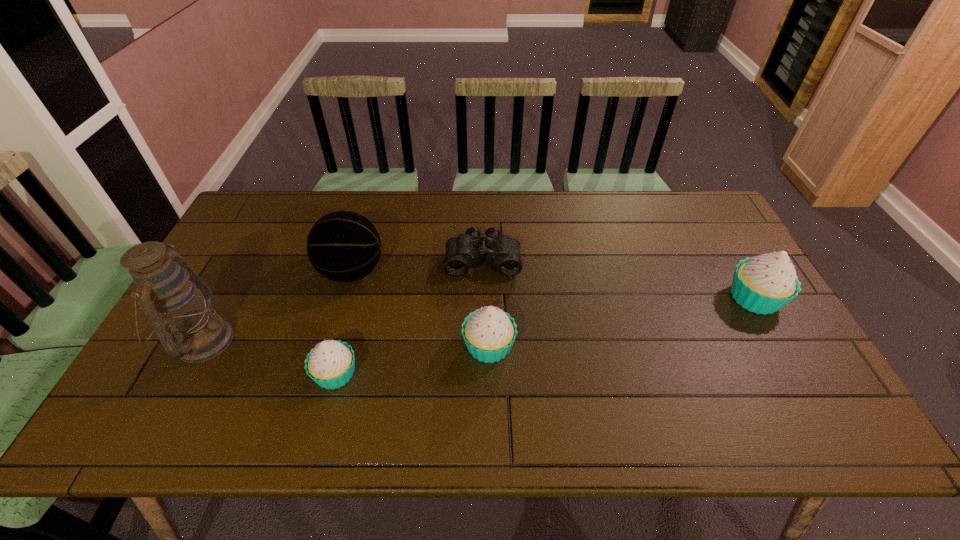
Where is `the shortest cupcake`? The width and height of the screenshot is (960, 540). the shortest cupcake is located at coordinates (330, 364).

What are the coordinates of `the second shortest object` in the screenshot? It's located at (330, 364).

Find the location of a particular element. This screenshot has width=960, height=540. the second shortest cupcake is located at coordinates (489, 333).

Image resolution: width=960 pixels, height=540 pixels. I want to click on the second cupcake from left to right, so click(x=489, y=333).

This screenshot has width=960, height=540. Identify the location of the rightmost object. (764, 284).

Locate an element on the screen. The height and width of the screenshot is (540, 960). the farthest cupcake is located at coordinates (764, 284).

Where is `the leftmost object`? The width and height of the screenshot is (960, 540). the leftmost object is located at coordinates (169, 292).

Locate an element on the screen. the tallest object is located at coordinates (169, 292).

Where is `binoculars`? binoculars is located at coordinates (462, 252).

Image resolution: width=960 pixels, height=540 pixels. I want to click on basketball, so click(x=343, y=246).